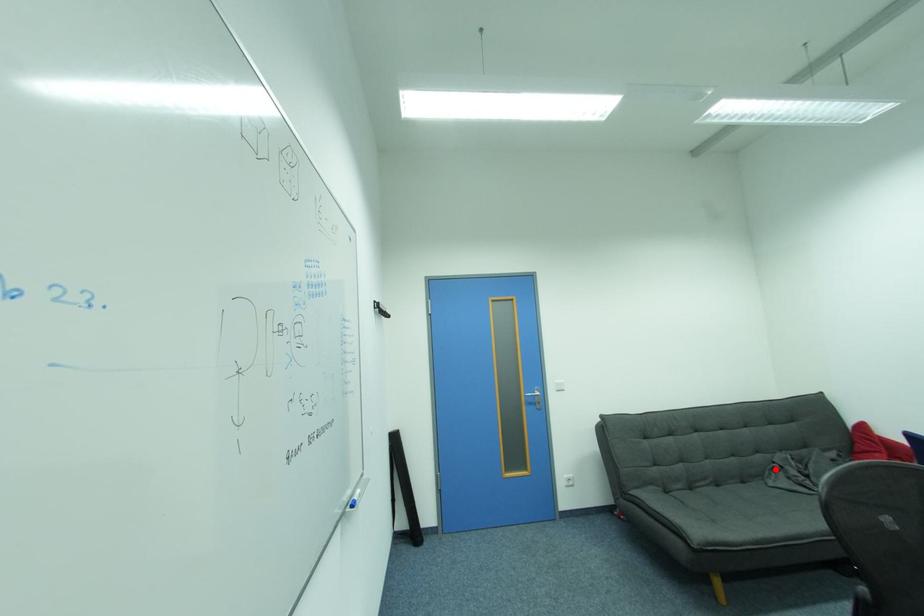
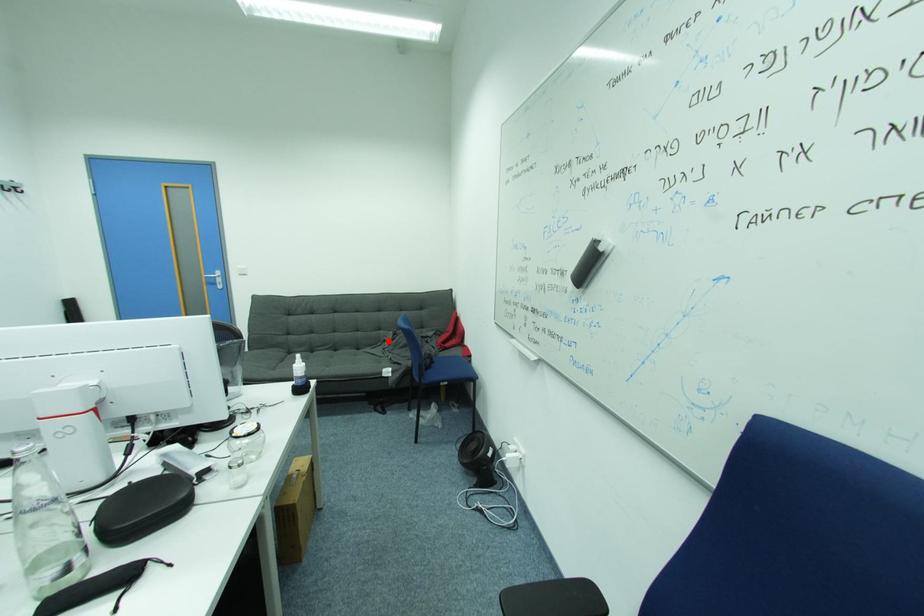
I am providing you with two images of the same scene from different viewpoints. A red point is marked on the first image and another point is marked on the second image. Is the marked point in image1 the same physical position as the marked point in image2?

Yes